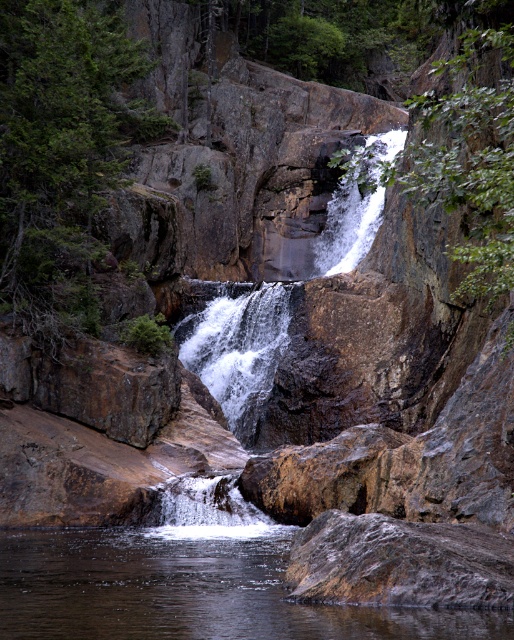
Can you confirm if clear water at center is wider than white frothy water at center?

Indeed, clear water at center has a greater width compared to white frothy water at center.

Is clear water at center to the left of white frothy water at center from the viewer's perspective?

Correct, you'll find clear water at center to the left of white frothy water at center.

Does point (60, 573) lie behind point (247, 301)?

No, (60, 573) is closer to viewer.

I want to click on clear water at center, so click(x=190, y=589).

Who is more forward, (348, 252) or (188, 317)?

Positioned in front is point (188, 317).

Is rough stone waterfall at center closer to camera compared to white frothy water at center?

Yes.

This screenshot has width=514, height=640. What do you see at coordinates (238, 349) in the screenshot? I see `rough stone waterfall at center` at bounding box center [238, 349].

At what (x,y) coordinates should I click in order to perform the action: click on rough stone waterfall at center. Please return your answer as a coordinate pair (x, y). This screenshot has height=640, width=514. Looking at the image, I should click on (238, 349).

Can you confirm if clear water at center is positioned below rough stone waterfall at center?

Indeed, clear water at center is positioned under rough stone waterfall at center.

Can you confirm if clear water at center is wider than rough stone waterfall at center?

Incorrect, clear water at center's width does not surpass rough stone waterfall at center's.

The width and height of the screenshot is (514, 640). What do you see at coordinates (190, 589) in the screenshot?
I see `clear water at center` at bounding box center [190, 589].

You are a GUI agent. You are given a task and a screenshot of the screen. Output one action in this format:
    pyautogui.click(x=<x>, y=<y>)
    Task: Click on the clear water at center
    
    Given the screenshot: What is the action you would take?
    pyautogui.click(x=190, y=589)